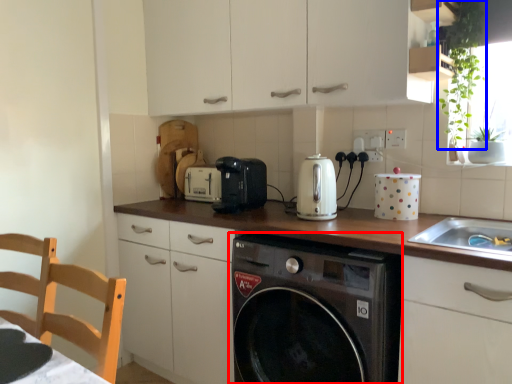
Question: Which object is further to the camera taking this photo, washing machine (highlighted by a red box) or plant (highlighted by a blue box)?

Choices:
 (A) washing machine
 (B) plant

Answer: (B)